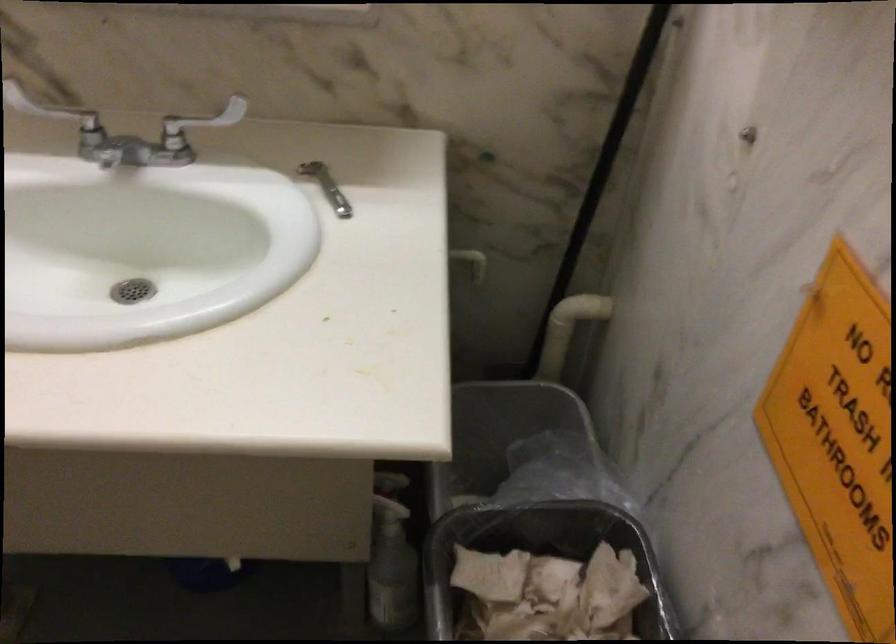
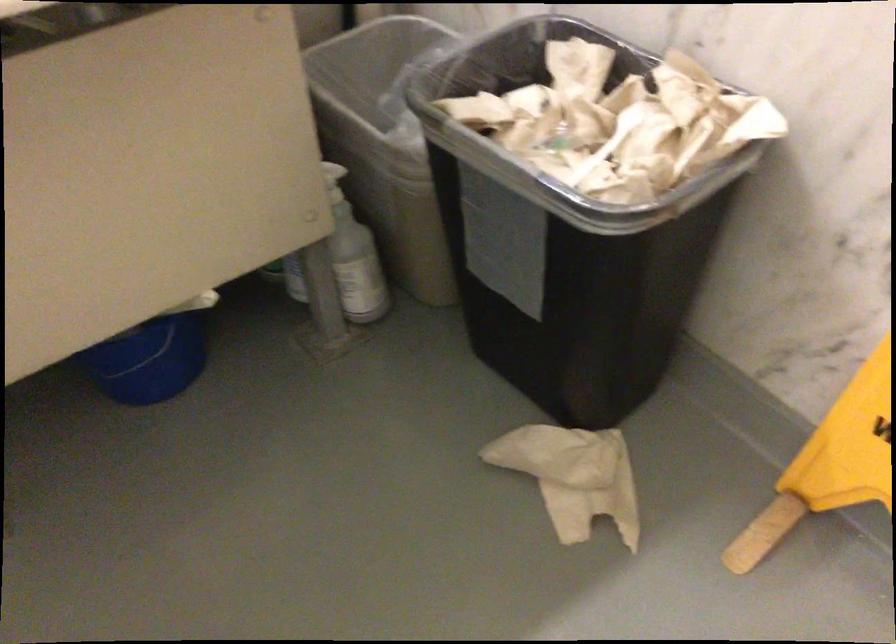
Where in the second image is the point corresponding to (x=177, y=565) from the first image?

(149, 361)